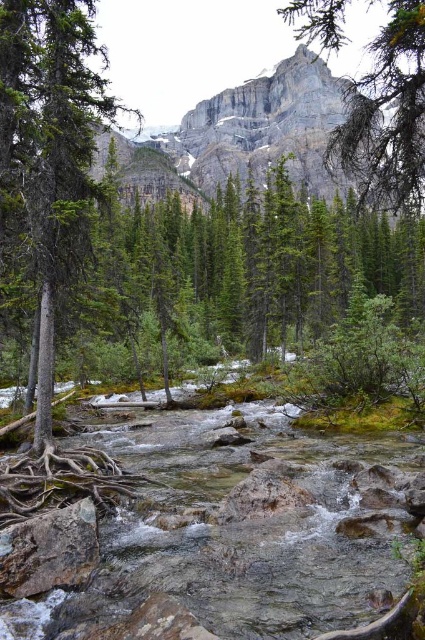
You are an environmental scientist assessing the biodiversity of this river ecosystem. You need to determine which object, the green rough bark tree at upper center or the gray rough rock at center, has a greater width to support more plant growth. Which one is wider?

The green rough bark tree at upper center has a larger width than the gray rough rock at center, making it better suited to support more plant growth.

You are standing at the center of the riverbed in the image. You see a point marked at coordinates (48, 163). What object is located at that point?

The point at coordinates (48, 163) corresponds to the green matte tree at left.